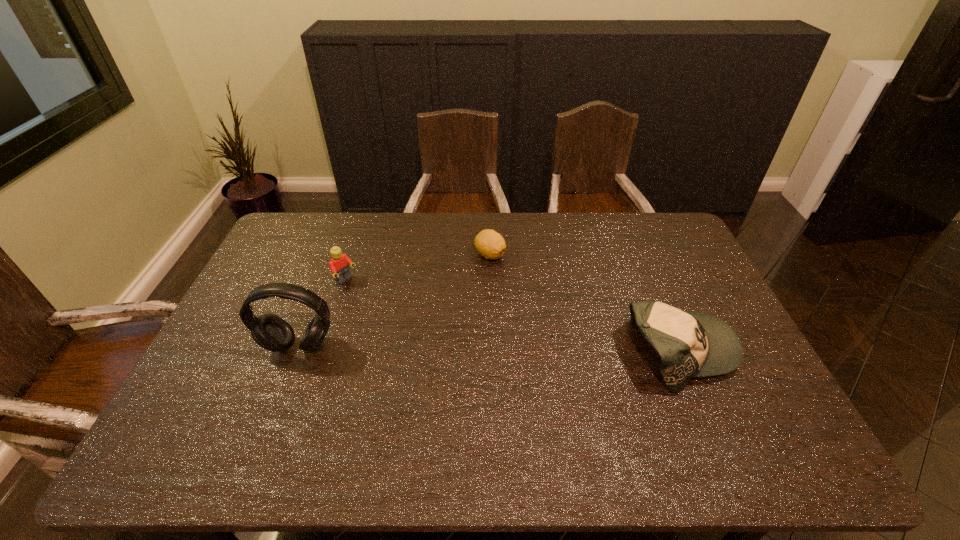
This screenshot has height=540, width=960. Find the location of `vacant space located on the face of the Lego`. vacant space located on the face of the Lego is located at coordinates (377, 304).

Identify the location of vacant space situated on the face of the Lego. (392, 314).

At what (x,y) coordinates should I click in order to perform the action: click on object present at the far edge. Please return your answer as a coordinate pair (x, y). Looking at the image, I should click on (490, 244).

Identify the location of object that is at the near edge. (690, 344).

At what (x,y) coordinates should I click in order to perform the action: click on object situated at the left edge. Please return your answer as a coordinate pair (x, y). This screenshot has height=540, width=960. Looking at the image, I should click on (271, 332).

The width and height of the screenshot is (960, 540). Identify the location of object that is positioned at the right edge. (690, 344).

Locate an element on the screen. The image size is (960, 540). object that is positioned at the near right corner is located at coordinates (690, 344).

You are a GUI agent. You are given a task and a screenshot of the screen. Output one action in this format:
    pyautogui.click(x=<x>, y=<y>)
    Task: Click on the vacant region at the far edge of the desktop
    
    Given the screenshot: What is the action you would take?
    pyautogui.click(x=604, y=232)

Locate an element on the screen. This screenshot has height=540, width=960. vacant space at the left edge is located at coordinates (243, 299).

In order to click on free location at the right edge of the desktop in this screenshot , I will do `click(723, 320)`.